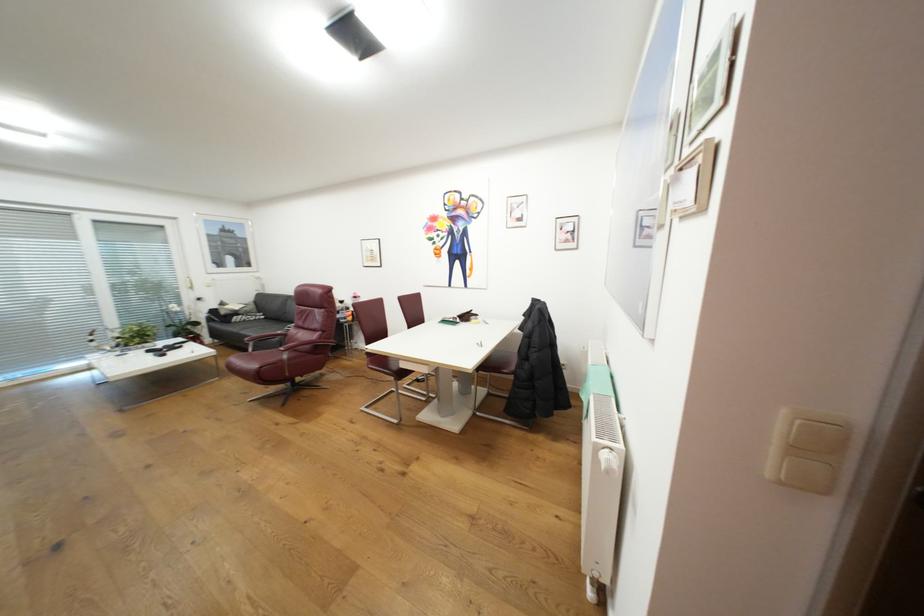
Image resolution: width=924 pixels, height=616 pixels. What are the coordinates of `red chair sitting surface` in the screenshot? It's located at (274, 366).